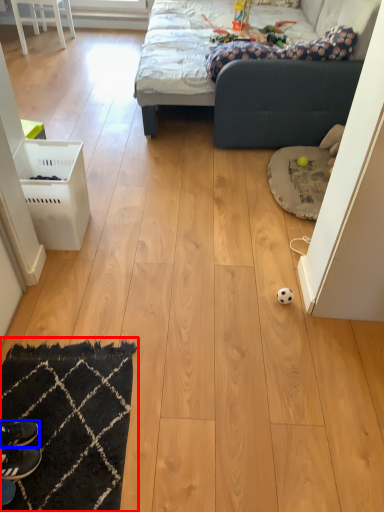
Question: Which object appears closest to the camera in this image, mat (highlighted by a red box) or footwear (highlighted by a blue box)?

Choices:
 (A) mat
 (B) footwear

Answer: (A)